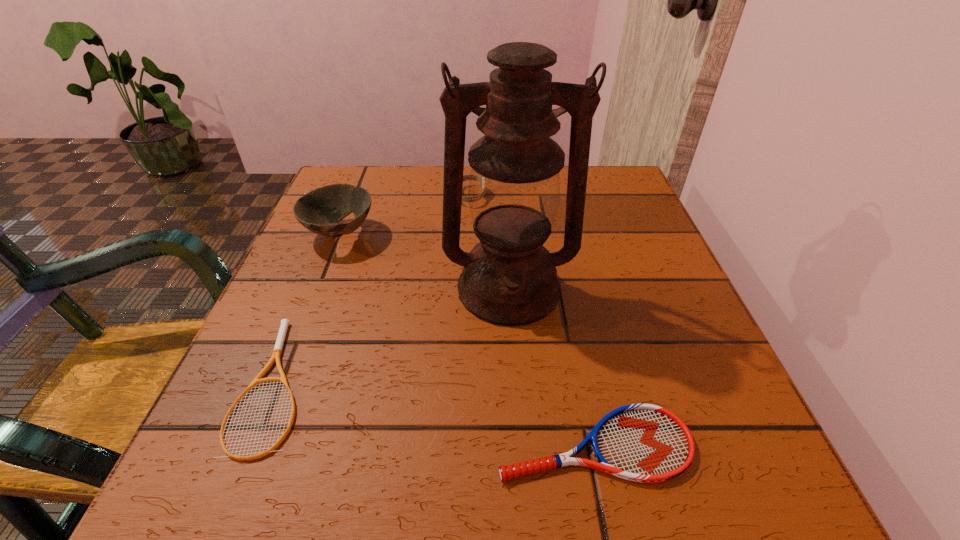
Find the location of a particular element. The image size is (960, 540). object present at the near right corner is located at coordinates (646, 443).

Identify the location of free space at the far edge of the desktop. (434, 166).

Where is `vacant region at the near edge of the desktop`? This screenshot has width=960, height=540. vacant region at the near edge of the desktop is located at coordinates coord(475,485).

In order to click on vacant space at the left edge of the desktop in this screenshot , I will do `click(359, 237)`.

Find the location of a particular element. The image size is (960, 540). vacant region at the right edge of the desktop is located at coordinates (686, 353).

Where is `free space at the far left corner of the desktop`? The height and width of the screenshot is (540, 960). free space at the far left corner of the desktop is located at coordinates (374, 219).

The image size is (960, 540). Find the location of `free space at the far right corner of the desktop`. free space at the far right corner of the desktop is located at coordinates (619, 165).

Where is `vacant point located between the tallest object and the shortest object`? Image resolution: width=960 pixels, height=540 pixels. vacant point located between the tallest object and the shortest object is located at coordinates (393, 336).

This screenshot has height=540, width=960. What are the coordinates of `free space between the oil lamp and the right tennis racket` in the screenshot? It's located at (552, 366).

The image size is (960, 540). I want to click on free space between the oil lamp and the right tennis racket, so click(552, 366).